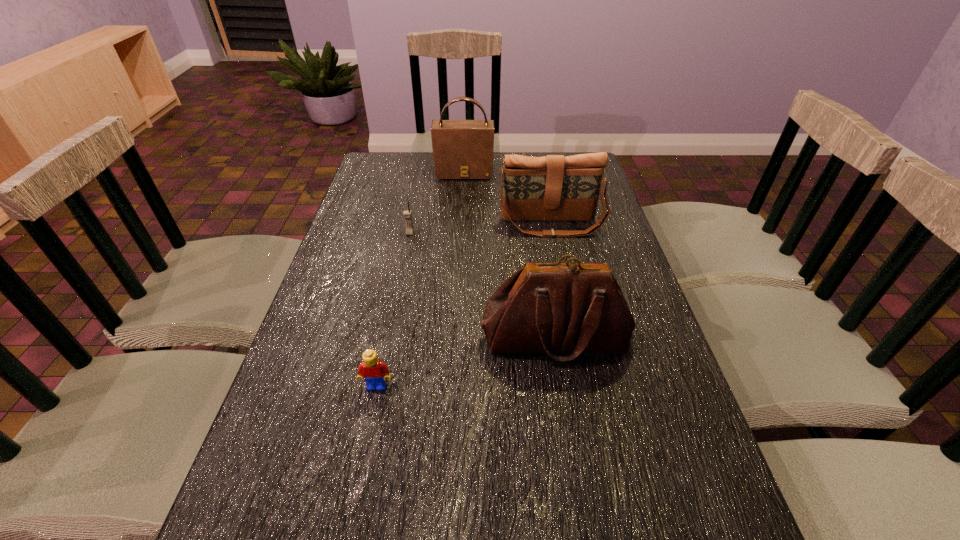
I want to click on the farthest object, so click(x=462, y=149).

Identify the location of the nearest shoulder bag. (574, 308).

Locate an element on the screen. the second nearest shoulder bag is located at coordinates (550, 188).

Where is `cellular telephone`? The width and height of the screenshot is (960, 540). cellular telephone is located at coordinates (407, 215).

Find the location of a particular element. The height and width of the screenshot is (540, 960). the nearest object is located at coordinates (374, 371).

The width and height of the screenshot is (960, 540). In order to click on vacant space situated 0.180m on the front flap of the farthest shoulder bag in this screenshot , I will do click(462, 210).

Identify the location of free spot located 0.280m on the left of the nearest shoulder bag. (359, 338).

You are a GUI agent. You are given a task and a screenshot of the screen. Output one action in this format:
    pyautogui.click(x=<x>, y=<y>)
    Task: Click on the free spot located on the front-facing side of the second nearest shoulder bag
    This screenshot has width=960, height=540.
    Given the screenshot: What is the action you would take?
    pyautogui.click(x=569, y=313)

The height and width of the screenshot is (540, 960). I want to click on vacant space located on the front of the cellular telephone, where the keypad is located, so click(x=400, y=281).

Image resolution: width=960 pixels, height=540 pixels. I want to click on vacant space located 0.250m on the front-facing side of the Lego, so click(349, 524).